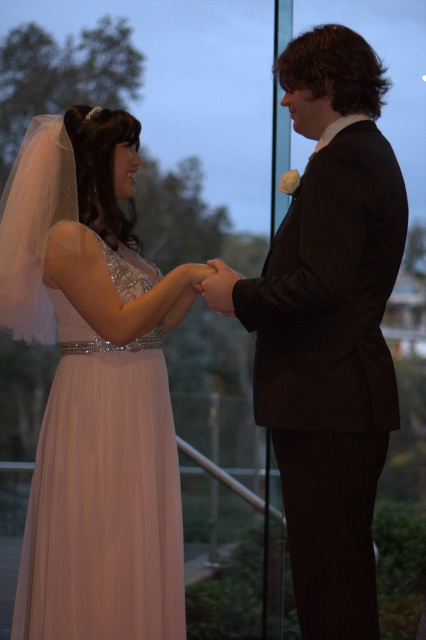
Question: Is satin pink dress at left behind black satin suit at center?

Choices:
 (A) yes
 (B) no

Answer: (A)

Question: Which point is farther to the camera?

Choices:
 (A) (317, 109)
 (B) (164, 612)

Answer: (B)

Question: Can you confirm if satin pink dress at left is positioned above black satin suit at center?

Choices:
 (A) no
 (B) yes

Answer: (A)

Question: Which point appears farthest from the camera in this image?

Choices:
 (A) (296, 419)
 (B) (62, 330)

Answer: (B)

Question: Where is satin pink dress at left located in relation to black satin suit at center in the image?

Choices:
 (A) right
 (B) left

Answer: (B)